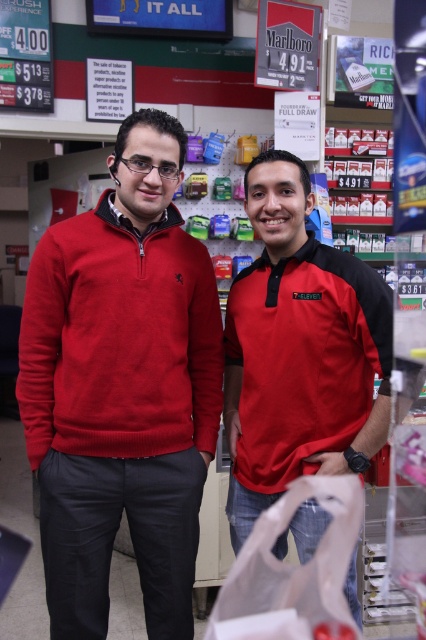
You are a photographer standing in front of the two people in the convenience store. You want to take a picture of both the matte red sweater at center and the matte red polo shirt at center. If your camera has a lens that can focus on objects within a 12 inch range, will you be able to capture both items clearly in the same photo?

The matte red sweater at center and matte red polo shirt at center are 13.14 inches apart, which is slightly beyond the 12 inch range of your camera lens. Therefore, you may not be able to capture both items clearly in the same photo.

From the picture: You are a cashier in a store and need to place a price tag between the matte red polo shirt at center and the transparent plastic bag at center. The price tag is 10 centimeters wide. Is there enough space between them to fit the price tag?

The matte red polo shirt at center is 32.99 centimeters away from the transparent plastic bag at center. Since the price tag is only 10 centimeters wide, there is sufficient space between them to place the price tag.